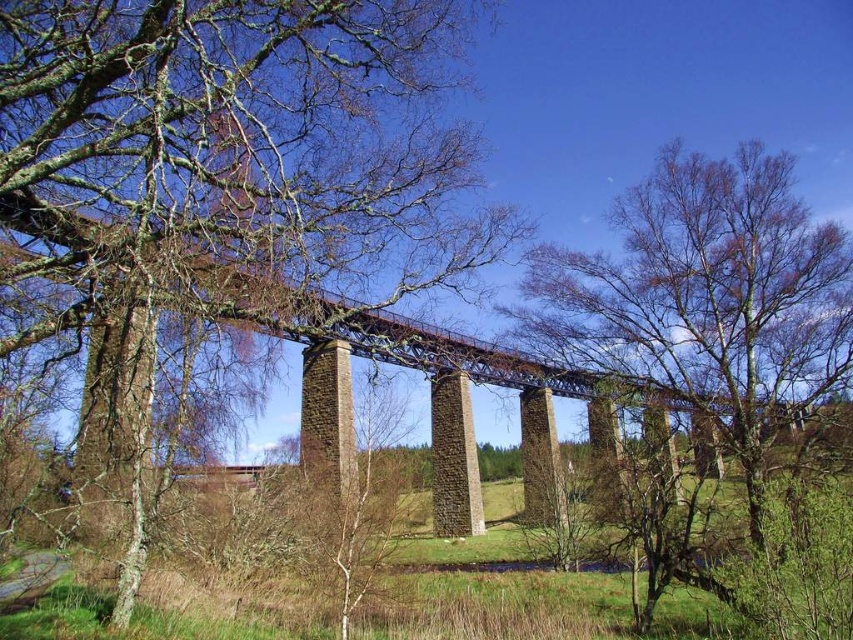
Question: Can you confirm if smooth bark tree at center is smaller than green leafy tree at center?

Choices:
 (A) yes
 (B) no

Answer: (A)

Question: Is green leafy tree at center above brown stone bridge at center?

Choices:
 (A) yes
 (B) no

Answer: (A)

Question: Is smooth bark tree at center to the right of green leafy tree at center from the viewer's perspective?

Choices:
 (A) no
 (B) yes

Answer: (A)

Question: Which point is closer to the camera?

Choices:
 (A) (485, 362)
 (B) (469, 272)

Answer: (B)

Question: Among these points, which one is nearest to the camera?

Choices:
 (A) (148, 440)
 (B) (189, 276)

Answer: (B)

Question: Among these points, which one is farthest from the camera?

Choices:
 (A) 225,52
 (B) 769,420

Answer: (B)